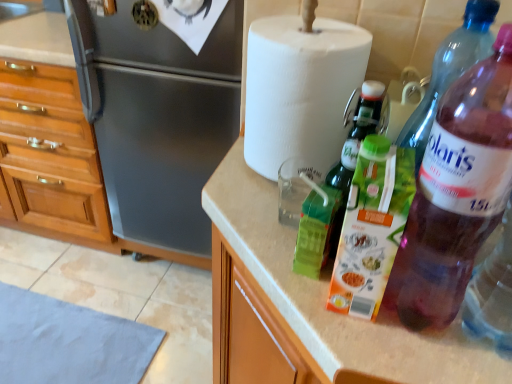
Where is `vacant space to the left of green matte carton at center, placed as the second bottle when sorted from back to front`? This screenshot has height=384, width=512. vacant space to the left of green matte carton at center, placed as the second bottle when sorted from back to front is located at coordinates (274, 265).